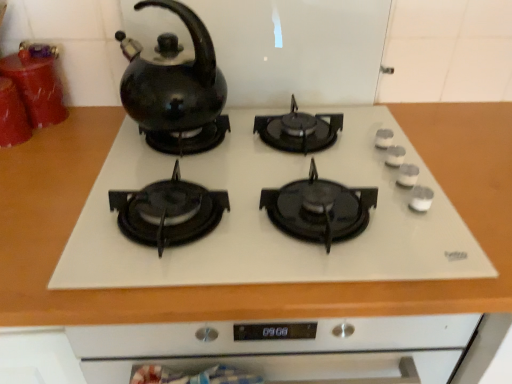
Where is `matte red canister at left, which appears as the 1th kitchen appliance when viewed from the front`? matte red canister at left, which appears as the 1th kitchen appliance when viewed from the front is located at coordinates (12, 116).

What do you see at coordinates (173, 80) in the screenshot? I see `black glossy kettle at upper left` at bounding box center [173, 80].

Find the location of a particular element. shiny red glass cups at left, which is counted as the 1th kitchen appliance, starting from the back is located at coordinates (37, 82).

How different are the orientations of matte red canister at left, the second kitchen appliance viewed from the back, and shiny red glass cups at left, the second kitchen appliance positioned from the front, in degrees?

They differ by 1.67 degrees in their facing directions.

From a real-world perspective, is matte red canister at left, the second kitchen appliance viewed from the back, located higher than shiny red glass cups at left, the second kitchen appliance positioned from the front?

Incorrect, from a real-world perspective, matte red canister at left, the second kitchen appliance viewed from the back, is lower than shiny red glass cups at left, the second kitchen appliance positioned from the front.

Between point (19, 95) and point (37, 125), which one is positioned behind?

The point (37, 125) is farther.

Would you consider matte red canister at left, the second kitchen appliance viewed from the back, to be distant from shiny red glass cups at left, which is counted as the 1th kitchen appliance, starting from the back?

No, matte red canister at left, the second kitchen appliance viewed from the back, is in close proximity to shiny red glass cups at left, which is counted as the 1th kitchen appliance, starting from the back.

Is shiny red glass cups at left, the second kitchen appliance positioned from the front, shorter than matte red canister at left, the second kitchen appliance viewed from the back?

No.

From a real-world perspective, does shiny red glass cups at left, the second kitchen appliance positioned from the front, sit lower than matte red canister at left, the second kitchen appliance viewed from the back?

No, from a real-world perspective, shiny red glass cups at left, the second kitchen appliance positioned from the front, is not beneath matte red canister at left, the second kitchen appliance viewed from the back.

From the image's perspective, is shiny red glass cups at left, which is counted as the 1th kitchen appliance, starting from the back, over matte red canister at left, the second kitchen appliance viewed from the back?

Correct, shiny red glass cups at left, which is counted as the 1th kitchen appliance, starting from the back, appears higher than matte red canister at left, the second kitchen appliance viewed from the back, in the image.

Is shiny red glass cups at left, the second kitchen appliance positioned from the front, at the back of white glossy gas stove at center?

No, white glossy gas stove at center's orientation is not away from shiny red glass cups at left, the second kitchen appliance positioned from the front.

Considering the sizes of objects white glossy gas stove at center and shiny red glass cups at left, which is counted as the 1th kitchen appliance, starting from the back, in the image provided, who is taller, white glossy gas stove at center or shiny red glass cups at left, which is counted as the 1th kitchen appliance, starting from the back,?

Standing taller between the two is shiny red glass cups at left, which is counted as the 1th kitchen appliance, starting from the back.

Considering the sizes of objects white glossy gas stove at center and shiny red glass cups at left, which is counted as the 1th kitchen appliance, starting from the back, in the image provided, who is wider, white glossy gas stove at center or shiny red glass cups at left, which is counted as the 1th kitchen appliance, starting from the back,?

white glossy gas stove at center.

Considering the positions of objects white glossy gas stove at center and shiny red glass cups at left, which is counted as the 1th kitchen appliance, starting from the back, in the image provided, who is behind, white glossy gas stove at center or shiny red glass cups at left, which is counted as the 1th kitchen appliance, starting from the back,?

shiny red glass cups at left, which is counted as the 1th kitchen appliance, starting from the back, is further away from the camera.

Which is in front, point (153, 113) or point (50, 81)?

Positioned in front is point (153, 113).

From the image's perspective, between black glossy kettle at upper left and shiny red glass cups at left, which is counted as the 1th kitchen appliance, starting from the back, which one is located above?

shiny red glass cups at left, which is counted as the 1th kitchen appliance, starting from the back, appears higher in the image.

From a real-world perspective, between black glossy kettle at upper left and shiny red glass cups at left, which is counted as the 1th kitchen appliance, starting from the back, who is vertically lower?

From a 3D spatial view, shiny red glass cups at left, which is counted as the 1th kitchen appliance, starting from the back, is below.

Is black glossy kettle at upper left next to shiny red glass cups at left, the second kitchen appliance positioned from the front?

No, black glossy kettle at upper left is not with shiny red glass cups at left, the second kitchen appliance positioned from the front.

From a real-world perspective, does black glossy kettle at upper left sit lower than white glossy gas stove at center?

Incorrect, from a real-world perspective, black glossy kettle at upper left is higher than white glossy gas stove at center.

The height and width of the screenshot is (384, 512). What are the coordinates of `gas stove below the black glossy kettle at upper left (from a real-world perspective)` in the screenshot? It's located at (268, 218).

Between black glossy kettle at upper left and white glossy gas stove at center, which one has smaller width?

Thinner between the two is black glossy kettle at upper left.

Is black glossy kettle at upper left turned away from white glossy gas stove at center?

No, white glossy gas stove at center is not at the back of black glossy kettle at upper left.

Does white glossy gas stove at center appear on the left side of matte red canister at left, which appears as the 1th kitchen appliance when viewed from the front?

No, white glossy gas stove at center is not to the left of matte red canister at left, which appears as the 1th kitchen appliance when viewed from the front.

Which point is more forward, (258,270) or (25,123)?

The point (258,270) is closer.

Locate an element on the screen. kitchen appliance that is the 2nd one when counting leftward from the white glossy gas stove at center is located at coordinates (12, 116).

Looking at this image, from a real-world perspective, who is located lower, white glossy gas stove at center or matte red canister at left, the second kitchen appliance viewed from the back?

white glossy gas stove at center, from a real-world perspective.

Which object is positioned more to the left, white glossy gas stove at center or black glossy kettle at upper left?

Positioned to the left is black glossy kettle at upper left.

Looking at their sizes, would you say white glossy gas stove at center is wider or thinner than black glossy kettle at upper left?

Considering their sizes, white glossy gas stove at center looks broader than black glossy kettle at upper left.

Is white glossy gas stove at center positioned with its back to black glossy kettle at upper left?

white glossy gas stove at center does not have its back to black glossy kettle at upper left.

Would you say black glossy kettle at upper left is part of white glossy gas stove at center's contents?

No, black glossy kettle at upper left is not inside white glossy gas stove at center.

Locate an element on the screen. The height and width of the screenshot is (384, 512). kitchen appliance on the right of matte red canister at left, the second kitchen appliance viewed from the back is located at coordinates (37, 82).

Find the location of a particular element. The width and height of the screenshot is (512, 384). kitchen appliance that appears below the shiny red glass cups at left, which is counted as the 1th kitchen appliance, starting from the back (from a real-world perspective) is located at coordinates (12, 116).

Which object lies further to the anchor point shiny red glass cups at left, the second kitchen appliance positioned from the front, matte red canister at left, which appears as the 1th kitchen appliance when viewed from the front, or white glossy gas stove at center?

white glossy gas stove at center lies further to shiny red glass cups at left, the second kitchen appliance positioned from the front, than the other object.

When comparing their distances from black glossy kettle at upper left, does matte red canister at left, the second kitchen appliance viewed from the back, or shiny red glass cups at left, the second kitchen appliance positioned from the front, seem closer?

The object closer to black glossy kettle at upper left is shiny red glass cups at left, the second kitchen appliance positioned from the front.

Which object lies nearer to the anchor point shiny red glass cups at left, which is counted as the 1th kitchen appliance, starting from the back, white glossy gas stove at center or matte red canister at left, which appears as the 1th kitchen appliance when viewed from the front?

The object closer to shiny red glass cups at left, which is counted as the 1th kitchen appliance, starting from the back, is matte red canister at left, which appears as the 1th kitchen appliance when viewed from the front.

Which object lies nearer to the anchor point black glossy kettle at upper left, white glossy gas stove at center or matte red canister at left, which appears as the 1th kitchen appliance when viewed from the front?

white glossy gas stove at center lies closer to black glossy kettle at upper left than the other object.

Based on their spatial positions, is black glossy kettle at upper left or matte red canister at left, the second kitchen appliance viewed from the back, closer to white glossy gas stove at center?

The object closer to white glossy gas stove at center is black glossy kettle at upper left.

From the image, which object appears to be nearer to shiny red glass cups at left, the second kitchen appliance positioned from the front, black glossy kettle at upper left or matte red canister at left, which appears as the 1th kitchen appliance when viewed from the front?

matte red canister at left, which appears as the 1th kitchen appliance when viewed from the front, lies closer to shiny red glass cups at left, the second kitchen appliance positioned from the front, than the other object.

Consider the image. When comparing their distances from black glossy kettle at upper left, does shiny red glass cups at left, the second kitchen appliance positioned from the front, or matte red canister at left, the second kitchen appliance viewed from the back, seem further?

The object further to black glossy kettle at upper left is matte red canister at left, the second kitchen appliance viewed from the back.

Looking at the image, which one is located closer to shiny red glass cups at left, which is counted as the 1th kitchen appliance, starting from the back, black glossy kettle at upper left or white glossy gas stove at center?

black glossy kettle at upper left lies closer to shiny red glass cups at left, which is counted as the 1th kitchen appliance, starting from the back, than the other object.

Identify the location of kitchen appliance between matte red canister at left, which appears as the 1th kitchen appliance when viewed from the front, and white glossy gas stove at center, in the horizontal direction. (37, 82).

Image resolution: width=512 pixels, height=384 pixels. In order to click on kettle between shiny red glass cups at left, the second kitchen appliance positioned from the front, and white glossy gas stove at center, in the horizontal direction in this screenshot , I will do `click(173, 80)`.

This screenshot has height=384, width=512. Identify the location of kettle between matte red canister at left, the second kitchen appliance viewed from the back, and white glossy gas stove at center from left to right. (173, 80).

You are a GUI agent. You are given a task and a screenshot of the screen. Output one action in this format:
    pyautogui.click(x=<x>, y=<y>)
    Task: Click on the kitchen appliance between matte red canister at left, the second kitchen appliance viewed from the back, and black glossy kettle at upper left, in the horizontal direction
    This screenshot has width=512, height=384.
    Given the screenshot: What is the action you would take?
    pyautogui.click(x=37, y=82)